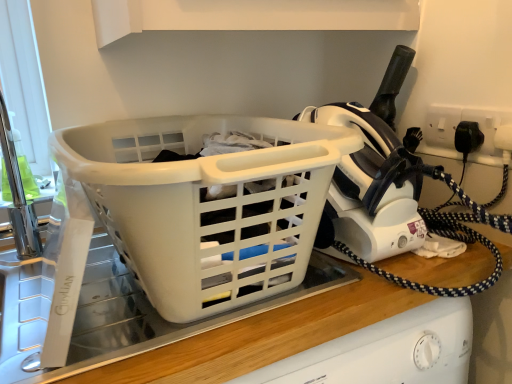
Question: Is white plastic basket at center taller or shorter than white plastic socket at upper right?

Choices:
 (A) tall
 (B) short

Answer: (A)

Question: From a real-world perspective, is white plastic basket at center above or below white plastic socket at upper right?

Choices:
 (A) below
 (B) above

Answer: (A)

Question: Which of these objects is positioned closest to the white plastic iron at upper right?

Choices:
 (A) white plastic basket at center
 (B) white plastic socket at upper right
 (C) white plastic iron at upper right

Answer: (C)

Question: Considering the real-world distances, which object is farthest from the white plastic iron at upper right?

Choices:
 (A) white plastic basket at center
 (B) white plastic iron at upper right
 (C) white plastic socket at upper right

Answer: (C)